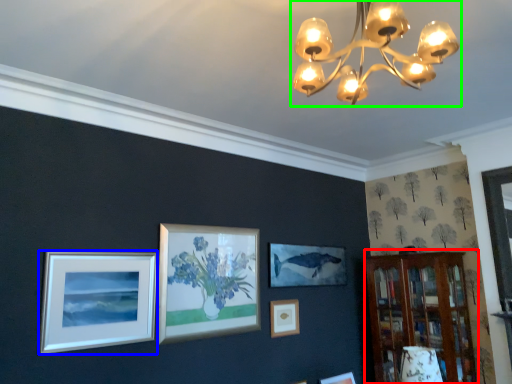
Question: Based on their relative distances, which object is nearer to bookshelf (highlighted by a red box)? Choose from picture frame (highlighted by a blue box) and lamp (highlighted by a green box).

Choices:
 (A) picture frame
 (B) lamp

Answer: (A)